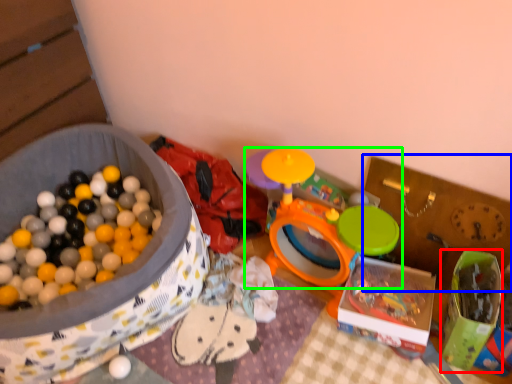
Question: Based on their relative distances, which object is nearer to box (highlighted by a red box)? Choose from storage box (highlighted by a blue box) and toy (highlighted by a green box).

Choices:
 (A) storage box
 (B) toy

Answer: (A)